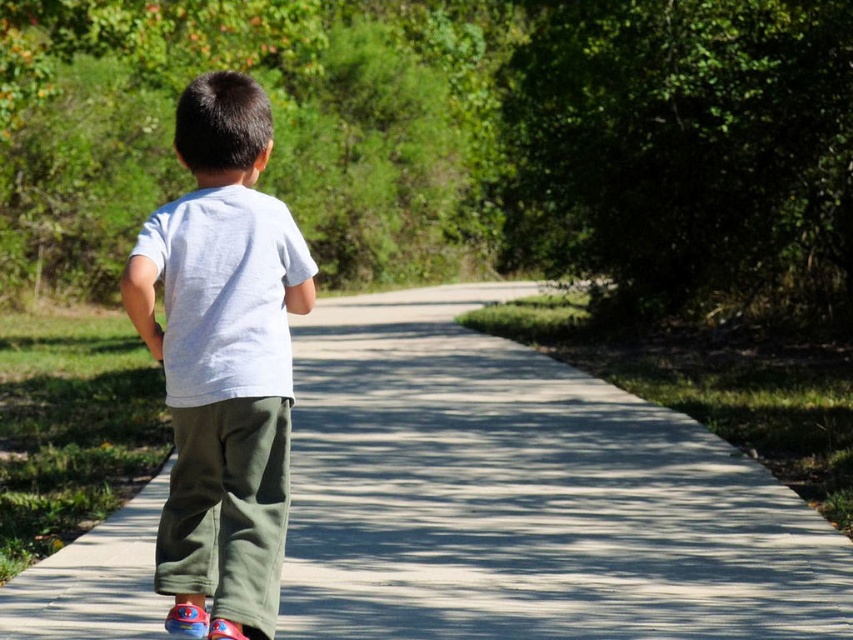
Question: Does smooth concrete pavement at center have a greater width compared to white cotton shirt at center?

Choices:
 (A) no
 (B) yes

Answer: (B)

Question: Does smooth concrete pavement at center have a smaller size compared to white cotton shirt at center?

Choices:
 (A) no
 (B) yes

Answer: (A)

Question: Which of the following is the farthest from the observer?

Choices:
 (A) (236, 508)
 (B) (437, 474)

Answer: (B)

Question: Does smooth concrete pavement at center have a greater width compared to white cotton shirt at center?

Choices:
 (A) no
 (B) yes

Answer: (B)

Question: Which object appears closest to the camera in this image?

Choices:
 (A) smooth concrete pavement at center
 (B) white cotton shirt at center

Answer: (B)

Question: Which point appears closest to the camera in this image?

Choices:
 (A) click(252, 528)
 (B) click(639, 634)

Answer: (A)